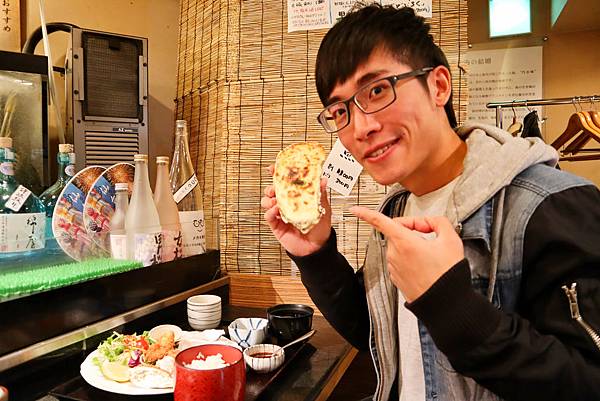
Identify the location of black marble countertop. (306, 387).